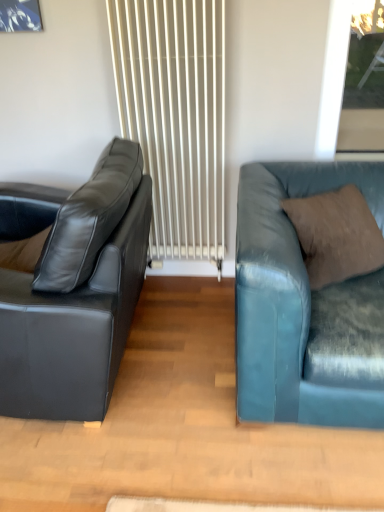
Identify the location of transparent glass window at upper right. (364, 84).

Find the location of `white textured radiator at center`. white textured radiator at center is located at coordinates (175, 117).

Measure the distance between matte black leather couch at left, the second studio couch positioned from the right, and camera.

1.19 meters.

You are a GUI agent. You are given a task and a screenshot of the screen. Output one action in this format:
    pyautogui.click(x=<x>, y=<y>)
    Task: Click on the teal leather couch at right, the 1th studio couch from the right
    The height and width of the screenshot is (512, 384).
    Given the screenshot: What is the action you would take?
    coord(304,307)

Does transparent glass window at upper right turn towards white textured radiator at center?

No, transparent glass window at upper right is not aimed at white textured radiator at center.

From the image's perspective, which is above, transparent glass window at upper right or white textured radiator at center?

Result: From the image's view, transparent glass window at upper right is above.

Can you tell me how much transparent glass window at upper right and white textured radiator at center differ in facing direction?

0.244 degrees.

Between transparent glass window at upper right and white textured radiator at center, which one has smaller size?

transparent glass window at upper right is smaller.

Is brown suede pillow at right taller than matte black leather couch at left, the second studio couch positioned from the right?

Incorrect, the height of brown suede pillow at right is not larger of that of matte black leather couch at left, the second studio couch positioned from the right.

How many degrees apart are the facing directions of brown suede pillow at right and matte black leather couch at left, the second studio couch positioned from the right?

123 degrees separate the facing orientations of brown suede pillow at right and matte black leather couch at left, the second studio couch positioned from the right.

Is matte black leather couch at left, which is the first studio couch in left-to-right order, a part of brown suede pillow at right?

No.

From a real-world perspective, between brown suede pillow at right and matte black leather couch at left, which is the first studio couch in left-to-right order, who is vertically higher?

brown suede pillow at right is physically above.

What's the angular difference between white textured radiator at center and transparent glass window at upper right's facing directions?

The facing directions of white textured radiator at center and transparent glass window at upper right are 0.244 degrees apart.

From a real-world perspective, between white textured radiator at center and transparent glass window at upper right, who is vertically higher?

transparent glass window at upper right is physically above.

Which of these two, white textured radiator at center or transparent glass window at upper right, is bigger?

Bigger between the two is white textured radiator at center.

Is teal leather couch at right, the 1th studio couch from the right, in front of or behind transparent glass window at upper right in the image?

Visually, teal leather couch at right, the 1th studio couch from the right, is located in front of transparent glass window at upper right.

From a real-world perspective, is teal leather couch at right, the 1th studio couch from the right, physically located above or below transparent glass window at upper right?

teal leather couch at right, the 1th studio couch from the right, is below transparent glass window at upper right.

How many degrees apart are the facing directions of teal leather couch at right, the 2th studio couch positioned from the left, and transparent glass window at upper right?

The facing directions of teal leather couch at right, the 2th studio couch positioned from the left, and transparent glass window at upper right are 1.28 degrees apart.

Considering the sizes of teal leather couch at right, the 1th studio couch from the right, and transparent glass window at upper right in the image, is teal leather couch at right, the 1th studio couch from the right, bigger or smaller than transparent glass window at upper right?

In the image, teal leather couch at right, the 1th studio couch from the right, appears to be larger than transparent glass window at upper right.

Looking at this image, is transparent glass window at upper right positioned before matte black leather couch at left, the second studio couch positioned from the right?

No.

Does point (371, 64) appear closer or farther from the camera than point (89, 405)?

Point (371, 64).

From a real-world perspective, does transparent glass window at upper right stand above matte black leather couch at left, the second studio couch positioned from the right?

Yes, from a real-world perspective, transparent glass window at upper right is over matte black leather couch at left, the second studio couch positioned from the right

How much distance is there between transparent glass window at upper right and matte black leather couch at left, the second studio couch positioned from the right?

transparent glass window at upper right is 1.53 meters from matte black leather couch at left, the second studio couch positioned from the right.

Which of these two, white textured radiator at center or teal leather couch at right, the 2th studio couch positioned from the left, is smaller?

With smaller size is white textured radiator at center.

Relative to teal leather couch at right, the 2th studio couch positioned from the left, is white textured radiator at center in front or behind?

Clearly, white textured radiator at center is behind teal leather couch at right, the 2th studio couch positioned from the left.

In order to click on the 2nd studio couch in front of the white textured radiator at center, counting from the anchor's position in this screenshot , I will do `click(304, 307)`.

Who is taller, white textured radiator at center or teal leather couch at right, the 1th studio couch from the right?

With more height is white textured radiator at center.

Based on the photo, would you say brown suede pillow at right is to the left or to the right of white textured radiator at center in the picture?

From the image, it's evident that brown suede pillow at right is to the right of white textured radiator at center.

Is white textured radiator at center completely or partially inside brown suede pillow at right?

No, brown suede pillow at right does not contain white textured radiator at center.

Who is more distant, brown suede pillow at right or white textured radiator at center?

white textured radiator at center is behind.

In the image, there is a white textured radiator at center. Where is `window screen above it (from the image's perspective)`? window screen above it (from the image's perspective) is located at coordinates (364, 84).

Identify the location of pillow above the matte black leather couch at left, the second studio couch positioned from the right (from a real-world perspective). Image resolution: width=384 pixels, height=512 pixels. (336, 234).

Based on their spatial positions, is transparent glass window at upper right or matte black leather couch at left, the second studio couch positioned from the right, further from brown suede pillow at right?

Based on the image, transparent glass window at upper right appears to be further to brown suede pillow at right.

From the image, which object appears to be farther from white textured radiator at center, matte black leather couch at left, the second studio couch positioned from the right, or teal leather couch at right, the 1th studio couch from the right?

Based on the image, teal leather couch at right, the 1th studio couch from the right, appears to be further to white textured radiator at center.

Which object lies further to the anchor point transparent glass window at upper right, teal leather couch at right, the 1th studio couch from the right, or white textured radiator at center?

teal leather couch at right, the 1th studio couch from the right, is positioned further to the anchor transparent glass window at upper right.

Based on their spatial positions, is transparent glass window at upper right or brown suede pillow at right closer to white textured radiator at center?

Among the two, brown suede pillow at right is located nearer to white textured radiator at center.

Which object lies further to the anchor point brown suede pillow at right, transparent glass window at upper right or teal leather couch at right, the 1th studio couch from the right?

transparent glass window at upper right is further to brown suede pillow at right.

Estimate the real-world distances between objects in this image. Which object is further from matte black leather couch at left, which is the first studio couch in left-to-right order, teal leather couch at right, the 1th studio couch from the right, or transparent glass window at upper right?

transparent glass window at upper right.

Looking at the image, which one is located further to brown suede pillow at right, teal leather couch at right, the 2th studio couch positioned from the left, or matte black leather couch at left, the second studio couch positioned from the right?

matte black leather couch at left, the second studio couch positioned from the right, is positioned further to the anchor brown suede pillow at right.

Looking at the image, which one is located further to brown suede pillow at right, white textured radiator at center or transparent glass window at upper right?

transparent glass window at upper right is further to brown suede pillow at right.

You are a GUI agent. You are given a task and a screenshot of the screen. Output one action in this format:
    pyautogui.click(x=<x>, y=<y>)
    Task: Click on the radiator between matte black leather couch at left, the second studio couch positioned from the right, and brown suede pillow at right from left to right
    The image size is (384, 512).
    Given the screenshot: What is the action you would take?
    pyautogui.click(x=175, y=117)

Where is `pillow situated between white textured radiator at center and transparent glass window at upper right from left to right`? The image size is (384, 512). pillow situated between white textured radiator at center and transparent glass window at upper right from left to right is located at coordinates (336, 234).

Locate an element on the screen. radiator between matte black leather couch at left, the second studio couch positioned from the right, and transparent glass window at upper right is located at coordinates 175,117.

Where is `pillow between matte black leather couch at left, the second studio couch positioned from the right, and teal leather couch at right, the 2th studio couch positioned from the left, from left to right`? The width and height of the screenshot is (384, 512). pillow between matte black leather couch at left, the second studio couch positioned from the right, and teal leather couch at right, the 2th studio couch positioned from the left, from left to right is located at coordinates (336, 234).